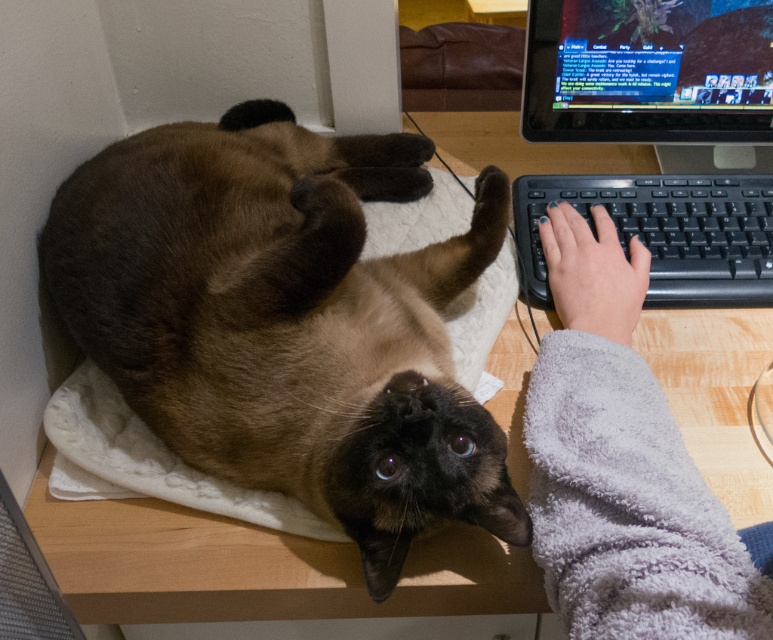
Based on the photo, can you confirm if black plastic keyboard at upper right is thinner than shiny plastic monitor at upper right?

No.

Is black plastic keyboard at upper right further to camera compared to shiny plastic monitor at upper right?

No, it is in front of shiny plastic monitor at upper right.

I want to click on black plastic keyboard at upper right, so click(659, 136).

From the picture: Can you confirm if satin brown cat at center is shorter than gray fuzzy sleeve at lower right?

No, satin brown cat at center is not shorter than gray fuzzy sleeve at lower right.

From the picture: Which is more to the left, satin brown cat at center or gray fuzzy sleeve at lower right?

satin brown cat at center

Is point (363, 376) positioned in front of point (611, 435)?

No, it is not.

This screenshot has width=773, height=640. Find the location of `satin brown cat at center`. satin brown cat at center is located at coordinates (285, 321).

Does gray fuzzy sleeve at lower right lie behind shiny plastic monitor at upper right?

No, it is not.

Can you confirm if gray fuzzy sleeve at lower right is smaller than shiny plastic monitor at upper right?

No.

Between point (557, 358) and point (567, 109), which one is positioned in front?

Point (557, 358) is more forward.

Image resolution: width=773 pixels, height=640 pixels. I want to click on gray fuzzy sleeve at lower right, so click(622, 467).